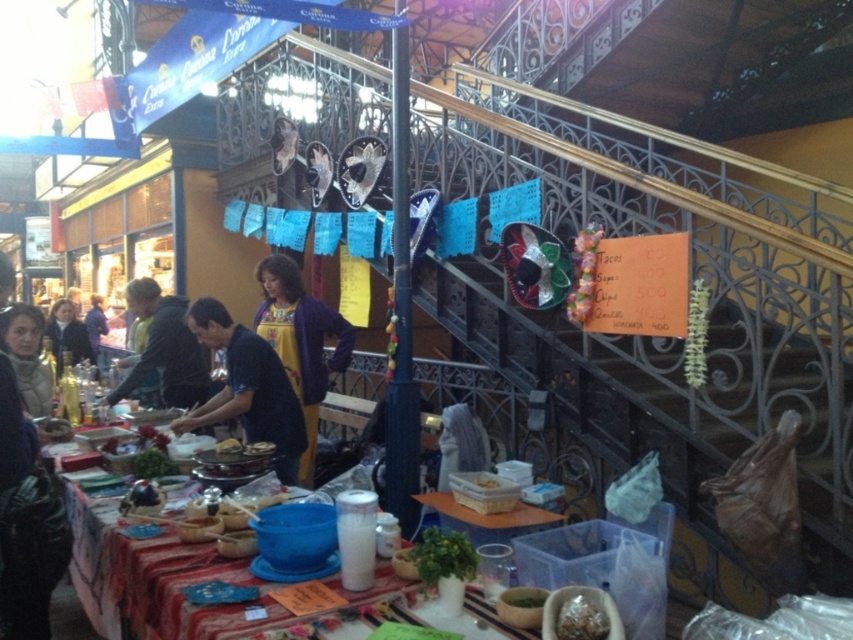
Question: Which object is positioned closest to the dark blue fabric at center?

Choices:
 (A) white plastic basket at center
 (B) dark blue sweater at left

Answer: (A)

Question: Is purple knitwear at center to the left of white plastic basket at center from the viewer's perspective?

Choices:
 (A) no
 (B) yes

Answer: (B)

Question: Which point is closer to the camera taking this photo?

Choices:
 (A) (62, 310)
 (B) (271, 392)
 (C) (259, 284)
 (D) (477, 474)

Answer: (D)

Question: Considering the relative positions of purple knitwear at center and white plastic basket at center in the image provided, where is purple knitwear at center located with respect to white plastic basket at center?

Choices:
 (A) left
 (B) right

Answer: (A)

Question: In this image, where is dark blue fabric at center located relative to white plastic basket at center?

Choices:
 (A) right
 (B) left

Answer: (B)

Question: Considering the real-world distances, which object is farthest from the white plastic basket at center?

Choices:
 (A) dark blue sweater at left
 (B) purple knitwear at center

Answer: (A)